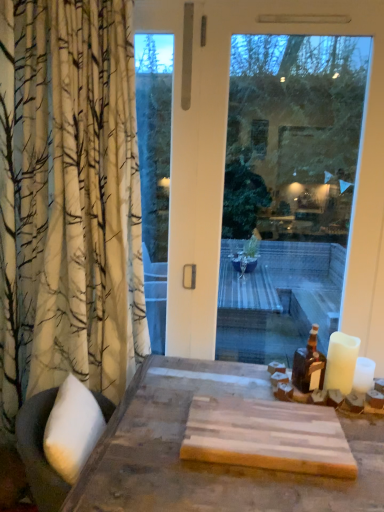
Question: Should I look upward or downward to see white matte candle at right?

Choices:
 (A) down
 (B) up

Answer: (A)

Question: From the image's perspective, does brown glass bottle at right appear lower than white matte candle at right?

Choices:
 (A) no
 (B) yes

Answer: (A)

Question: Considering the relative sizes of brown glass bottle at right and white matte candle at right in the image provided, is brown glass bottle at right bigger than white matte candle at right?

Choices:
 (A) no
 (B) yes

Answer: (B)

Question: Considering the relative sizes of brown glass bottle at right and white matte candle at right in the image provided, is brown glass bottle at right wider than white matte candle at right?

Choices:
 (A) yes
 (B) no

Answer: (A)

Question: Is brown glass bottle at right positioned beyond the bounds of white matte candle at right?

Choices:
 (A) no
 (B) yes

Answer: (B)

Question: Is white matte candle at right surrounded by brown glass bottle at right?

Choices:
 (A) no
 (B) yes

Answer: (A)

Question: From a real-world perspective, is brown glass bottle at right over white matte candle at right?

Choices:
 (A) yes
 (B) no

Answer: (A)

Question: From the image's perspective, is white matte candle at right on transparent glass window at center?

Choices:
 (A) no
 (B) yes

Answer: (A)

Question: Is white matte candle at right closer to camera compared to transparent glass window at center?

Choices:
 (A) yes
 (B) no

Answer: (A)

Question: From a real-world perspective, is white matte candle at right below transparent glass window at center?

Choices:
 (A) no
 (B) yes

Answer: (B)

Question: From the image's perspective, is white matte candle at right under transparent glass window at center?

Choices:
 (A) no
 (B) yes

Answer: (B)

Question: Does white matte candle at right appear on the left side of transparent glass window at center?

Choices:
 (A) no
 (B) yes

Answer: (A)

Question: Is white matte candle at right facing towards transparent glass window at center?

Choices:
 (A) no
 (B) yes

Answer: (A)

Question: From the image's perspective, is transparent glass window at center located beneath brown glass bottle at right?

Choices:
 (A) yes
 (B) no

Answer: (B)